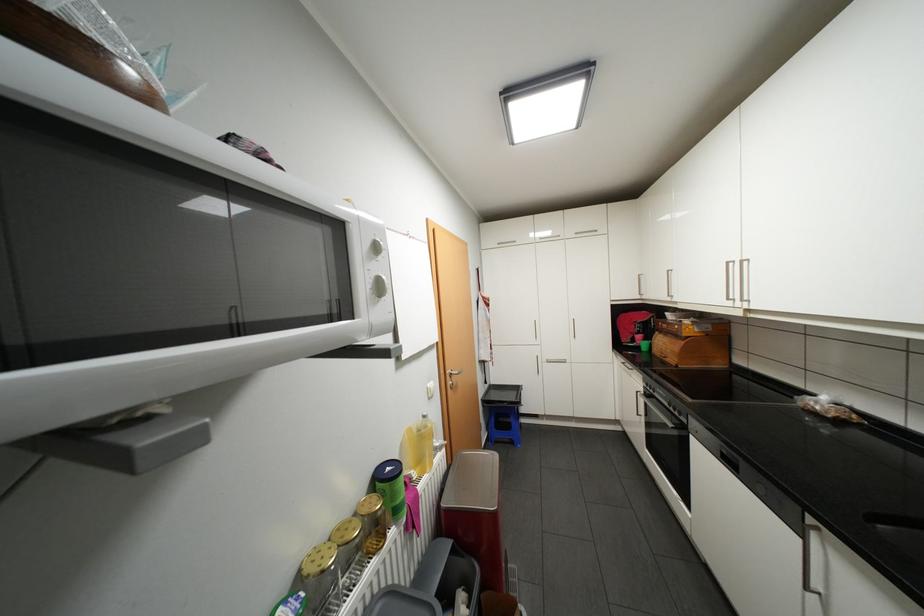
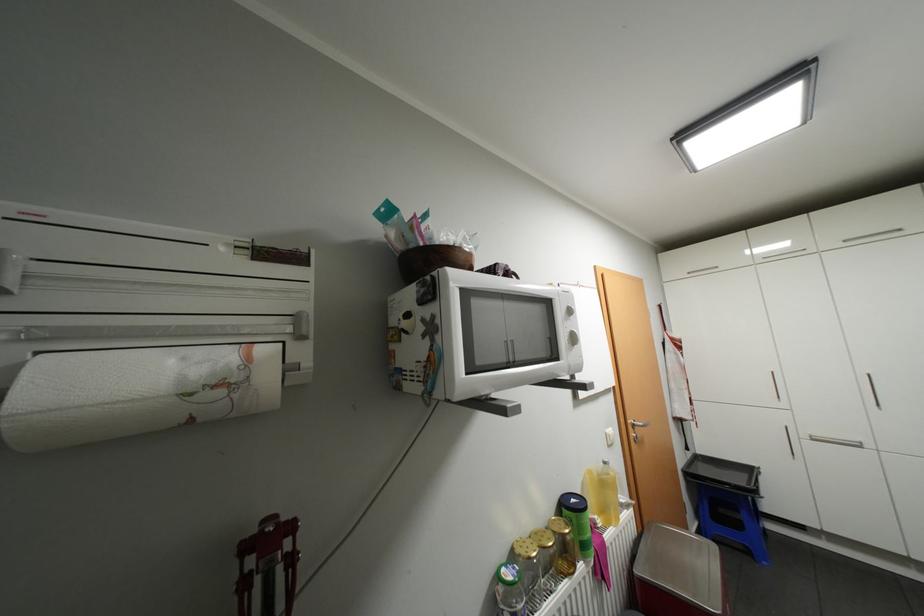
In the second image, find the point that corresponds to point 395,468 in the first image.

(580, 499)